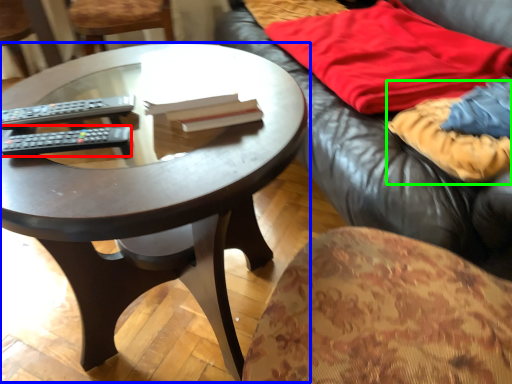
Question: Which object is positioned closest to remote control (highlighted by a red box)? Select from coffee table (highlighted by a blue box) and blanket (highlighted by a green box).

Choices:
 (A) coffee table
 (B) blanket

Answer: (A)